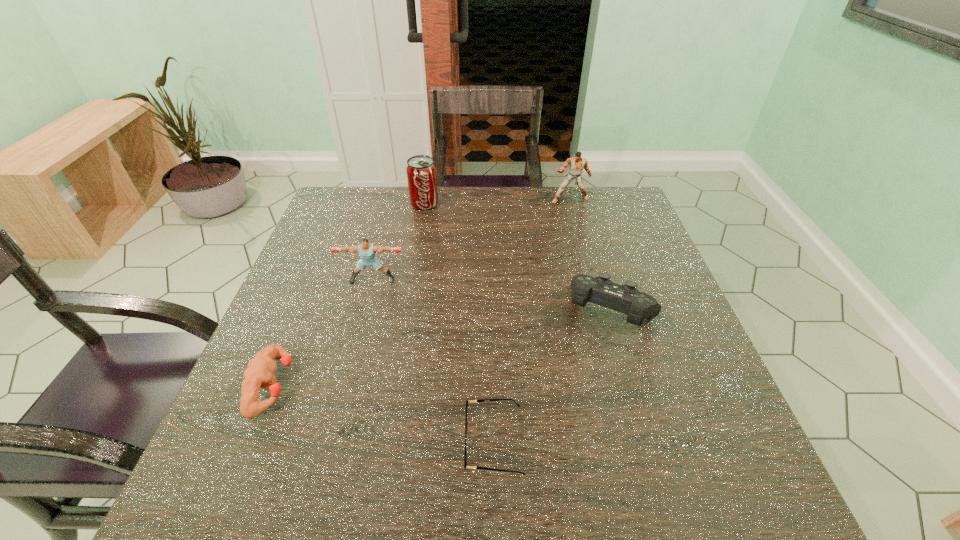
You are a GUI agent. You are given a task and a screenshot of the screen. Output one action in this format:
    pyautogui.click(x=<x>, y=<y>)
    Task: Click on the object located at the near edge
    The image size is (960, 540).
    Given the screenshot: What is the action you would take?
    pyautogui.click(x=465, y=463)

You are a GUI agent. You are given a task and a screenshot of the screen. Output one action in this format:
    pyautogui.click(x=<x>, y=<y>)
    Task: Click on the puncher that is positioned at the right edge
    The height and width of the screenshot is (540, 960).
    Given the screenshot: What is the action you would take?
    pyautogui.click(x=577, y=164)

You are a GUI agent. You are given a task and a screenshot of the screen. Output one action in this format:
    pyautogui.click(x=<x>, y=<y>)
    Task: Click on the control located at the right edge
    Image resolution: width=960 pixels, height=540 pixels.
    Given the screenshot: What is the action you would take?
    pyautogui.click(x=600, y=290)

You are a GUI agent. You are given a task and a screenshot of the screen. Output one action in this format:
    pyautogui.click(x=<x>, y=<y>)
    Task: Click on the object that is at the far right corner
    This screenshot has height=540, width=960.
    Given the screenshot: What is the action you would take?
    pyautogui.click(x=577, y=164)

Locate an element on the screen. Image resolution: width=960 pixels, height=540 pixels. vacant space at the far edge is located at coordinates (397, 214).

Image resolution: width=960 pixels, height=540 pixels. In the image, there is a desktop. What are the coordinates of `vacant area at the near edge` in the screenshot? It's located at (561, 485).

The image size is (960, 540). In order to click on vacant space at the left edge of the desktop in this screenshot , I will do `click(267, 450)`.

Identify the location of vacant position at the right edge of the desktop. (704, 415).

Locate an element on the screen. The height and width of the screenshot is (540, 960). vacant region at the far left corner of the desktop is located at coordinates (350, 187).

Identify the location of free spot at the near left corner of the desktop. The height and width of the screenshot is (540, 960). (270, 503).